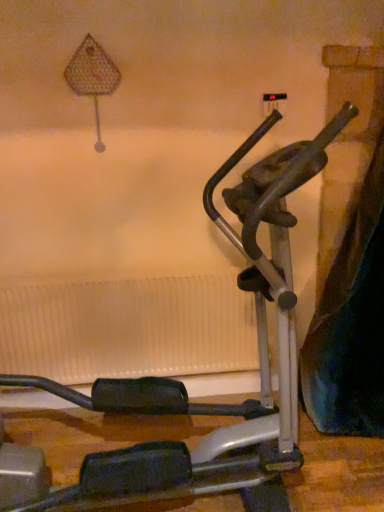
At what (x,y) coordinates should I click in order to perform the action: click on white ribbed radiator at center. Please return your answer as a coordinate pair (x, y). This screenshot has width=384, height=512. Looking at the image, I should click on (128, 329).

Image resolution: width=384 pixels, height=512 pixels. What do you see at coordinates (128, 329) in the screenshot?
I see `white ribbed radiator at center` at bounding box center [128, 329].

What is the approximate width of white ribbed radiator at center?

4.14 inches.

At what (x,y) coordinates should I click in order to perform the action: click on white ribbed radiator at center. Please return your answer as a coordinate pair (x, y). Looking at the image, I should click on (128, 329).